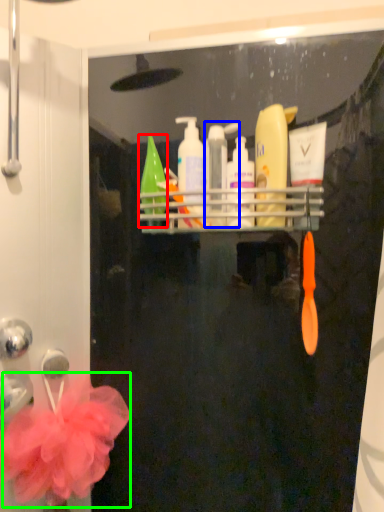
Question: Which object is positioned closest to cleaning product (highlighted by a red box)? Select from mouthwash (highlighted by a blue box) and flower (highlighted by a green box).

Choices:
 (A) mouthwash
 (B) flower

Answer: (A)